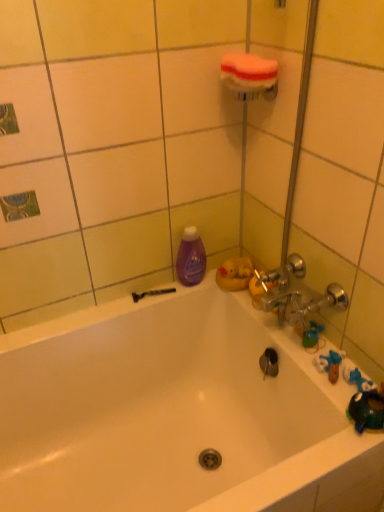
Question: Is purple glossy bottle at upper left to the left or to the right of black plastic razor at lower left in the image?

Choices:
 (A) left
 (B) right

Answer: (B)

Question: From a real-world perspective, is purple glossy bottle at upper left physically located above or below black plastic razor at lower left?

Choices:
 (A) above
 (B) below

Answer: (A)

Question: Estimate the real-world distances between objects in this image. Which object is farther from the black plastic razor at lower left?

Choices:
 (A) white glossy bathtub at center
 (B) purple glossy bottle at upper left
 (C) green rubber toy at right
 (D) orange sponge at upper center

Answer: (D)

Question: Which object is the farthest from the white glossy bathtub at center?

Choices:
 (A) green rubber toy at right
 (B) black plastic razor at lower left
 (C) orange sponge at upper center
 (D) purple glossy bottle at upper left

Answer: (C)